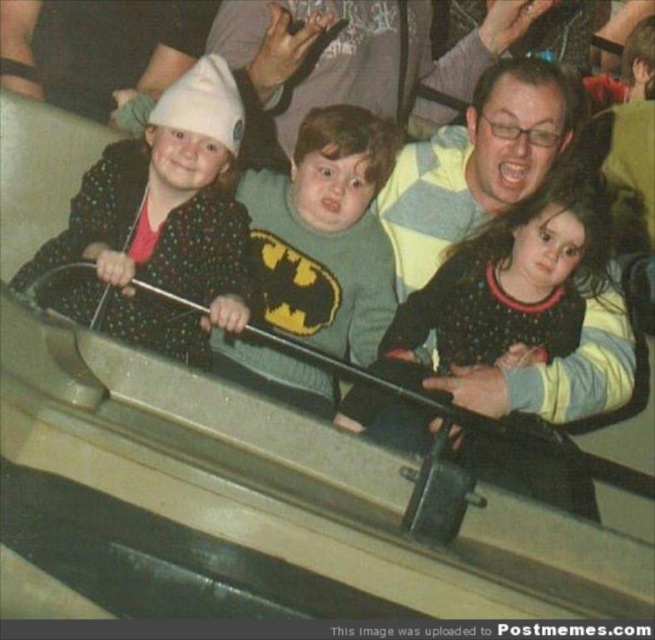
The width and height of the screenshot is (655, 640). What do you see at coordinates (162, 220) in the screenshot?
I see `white dotted sweater at left` at bounding box center [162, 220].

Does white dotted sweater at left have a lesser height compared to polka dot sweater at center?

Incorrect, white dotted sweater at left's height does not fall short of polka dot sweater at center's.

Between point (145, 225) and point (419, 317), which one is positioned behind?

Positioned behind is point (419, 317).

The width and height of the screenshot is (655, 640). What are the coordinates of `white dotted sweater at left` in the screenshot? It's located at (162, 220).

Who is more forward, (x=202, y=145) or (x=333, y=304)?

Point (x=202, y=145)

Is point (102, 301) in front of point (299, 291)?

That is True.

Identify the location of white dotted sweater at left. This screenshot has height=640, width=655. (162, 220).

Is polka dot sweater at center positioned before green knitted sweater at center?

Yes, it is.

What do you see at coordinates (508, 288) in the screenshot? I see `polka dot sweater at center` at bounding box center [508, 288].

You are a GUI agent. You are given a task and a screenshot of the screen. Output one action in this format:
    pyautogui.click(x=<x>, y=<y>)
    Task: Click on the polka dot sweater at center
    This screenshot has width=655, height=640.
    Given the screenshot: What is the action you would take?
    pyautogui.click(x=508, y=288)